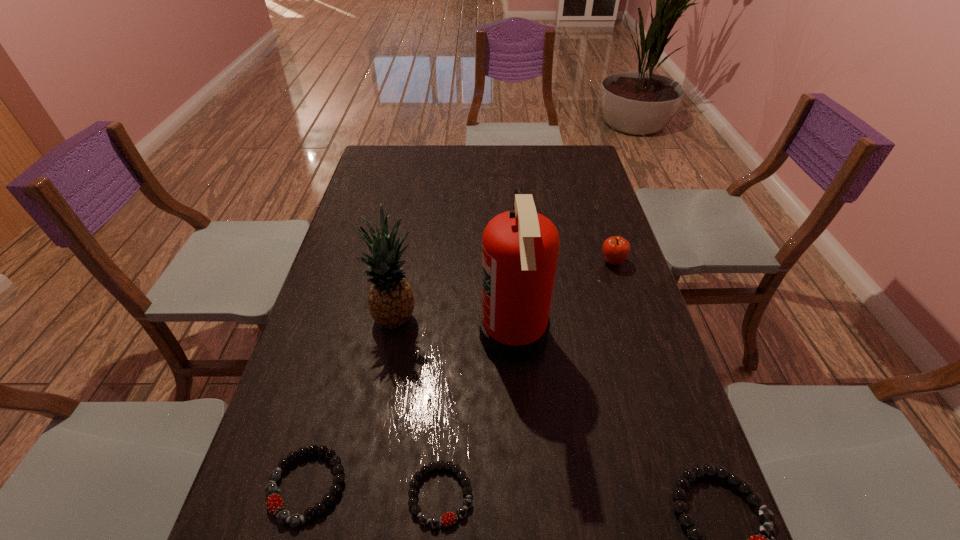
At what (x,y) coordinates should I click in order to perform the action: click on the second tallest bracelet. Please return your answer as a coordinate pair (x, y). Looking at the image, I should click on (283, 516).

At what (x,y) coordinates should I click in order to perform the action: click on the second shortest object. Please return your answer as a coordinate pair (x, y). Looking at the image, I should click on (283, 516).

What are the coordinates of `the shortest bracelet` in the screenshot? It's located at (449, 518).

Find the location of a particular element. This screenshot has height=540, width=960. the third object from left to right is located at coordinates (449, 518).

Find the location of a particular element. the fifth shortest object is located at coordinates (391, 301).

This screenshot has height=540, width=960. What are the coordinates of `the third tallest object` in the screenshot? It's located at (615, 249).

The width and height of the screenshot is (960, 540). I want to click on the farthest object, so pyautogui.click(x=615, y=249).

Find the location of a particular element. the third object from right to left is located at coordinates (520, 248).

Locate an element on the screen. The height and width of the screenshot is (540, 960). the tallest object is located at coordinates (520, 248).

Identify the location of vacant area situated 0.140m on the right of the leftmost bracelet. (417, 486).